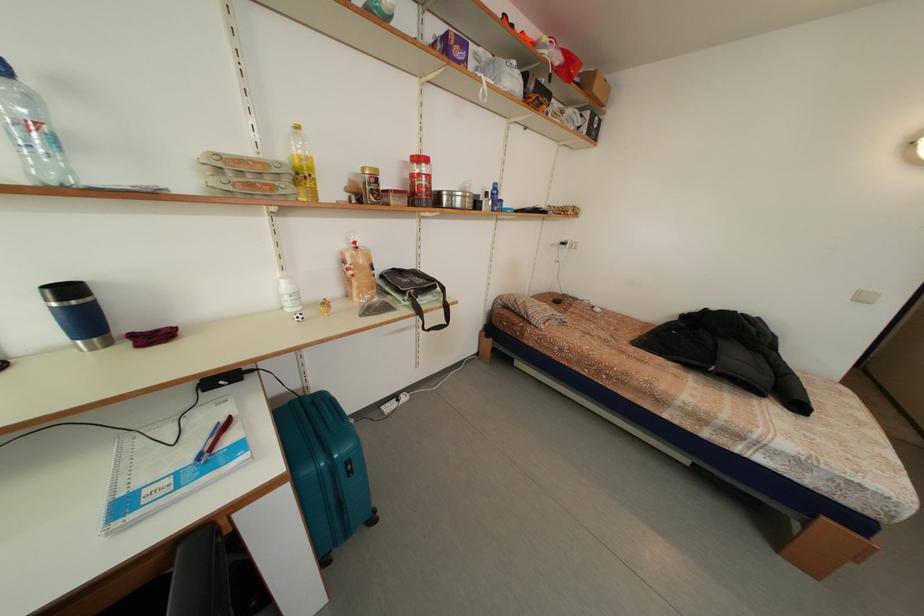
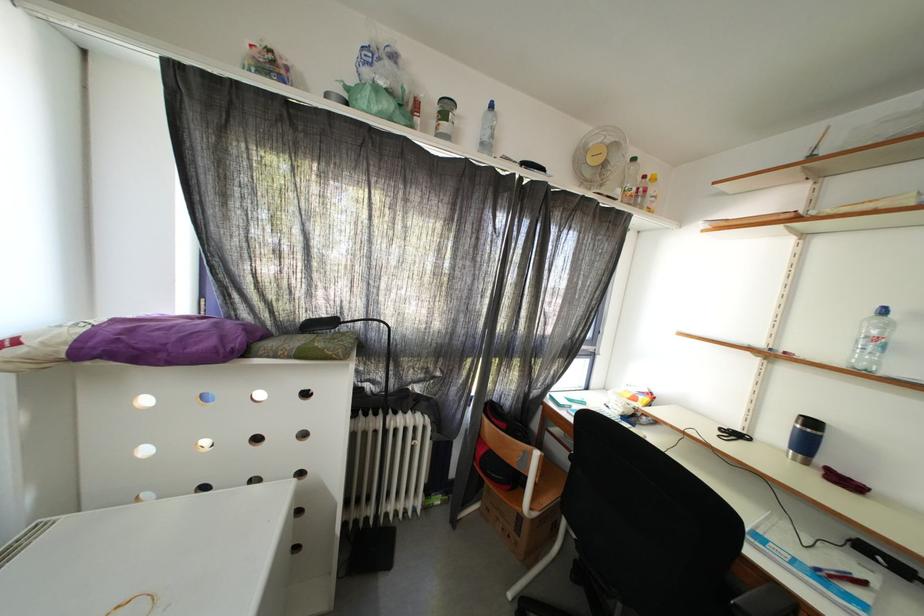
In the second image, find the point that corresponds to [240,442] in the first image.

(864, 597)